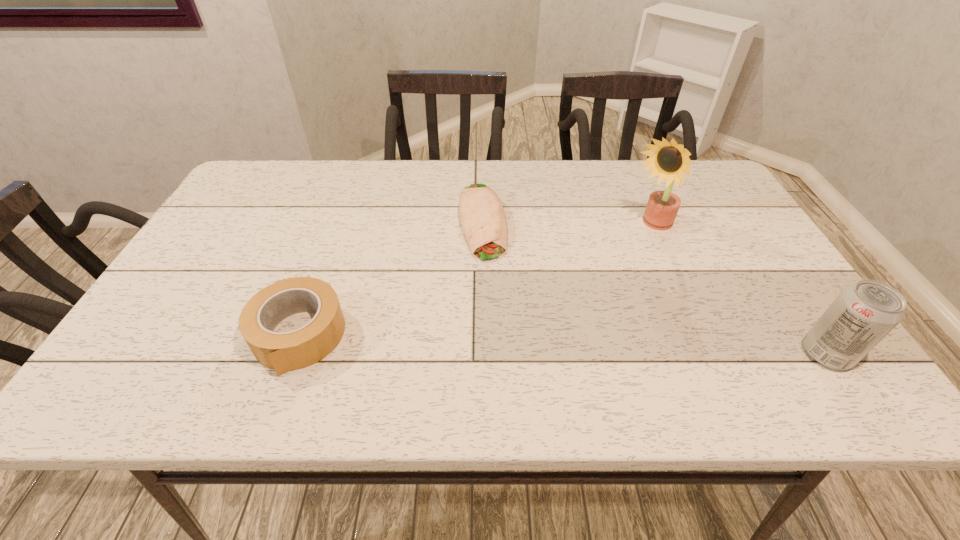
This screenshot has width=960, height=540. In order to click on vacant space on the desktop that is between the duct tape and the third shortest object and is positioned at the bitten end of the second object from left to right in this screenshot , I will do `click(508, 342)`.

Locate an element on the screen. This screenshot has width=960, height=540. vacant spot on the desktop that is between the leftmost object and the soda can and is positioned on the face of the tallest object is located at coordinates (500, 342).